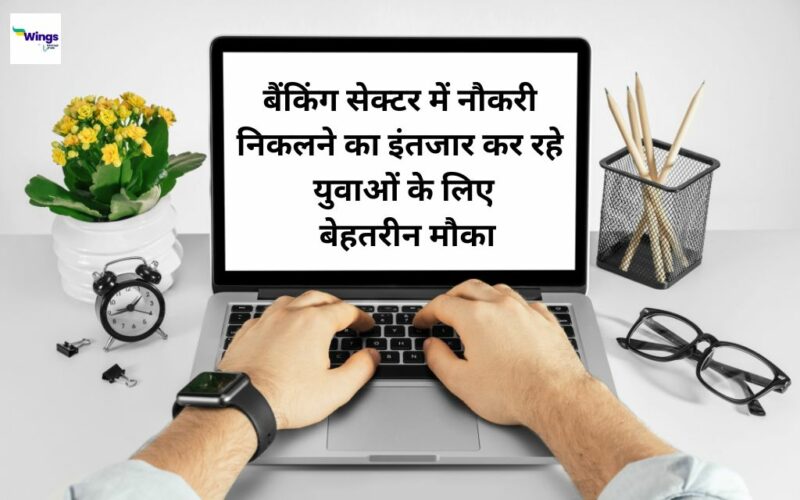
At what (x,y) coordinates should I click in order to perform the action: click on green plant leaves. Please return your answer as a coordinate pair (x, y). Looking at the image, I should click on (58, 195), (182, 168), (134, 180), (124, 206).